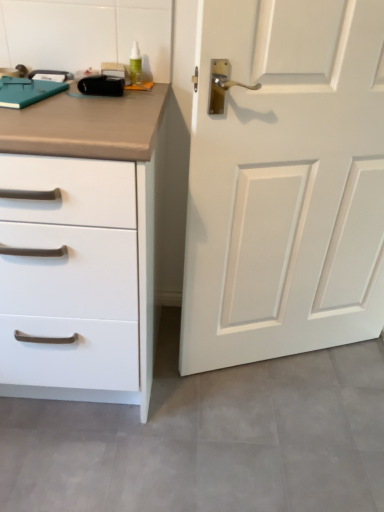
Find the location of a particular element. The height and width of the screenshot is (512, 384). white matte door at right is located at coordinates (285, 183).

What do you see at coordinates (285, 183) in the screenshot? I see `white matte door at right` at bounding box center [285, 183].

Measure the distance between white matte chest of drawers at left and camera.

The distance of white matte chest of drawers at left from camera is 33.12 inches.

The width and height of the screenshot is (384, 512). Describe the element at coordinates (81, 248) in the screenshot. I see `white matte chest of drawers at left` at that location.

Find the location of a particular element. The image size is (384, 512). white matte chest of drawers at left is located at coordinates (81, 248).

The image size is (384, 512). I want to click on white matte door at right, so click(x=285, y=183).

Considering the relative positions of white matte chest of drawers at left and white matte door at right in the image provided, is white matte chest of drawers at left to the left or to the right of white matte door at right?

Based on their positions, white matte chest of drawers at left is located to the left of white matte door at right.

Which object is closer to the camera, white matte chest of drawers at left or white matte door at right?

white matte chest of drawers at left is closer to the camera.

Which point is more forward, (x=11, y=173) or (x=361, y=100)?

The point (x=11, y=173) is closer.

From the image's perspective, which one is positioned higher, white matte chest of drawers at left or white matte door at right?

From the image's view, white matte door at right is above.

From a real-world perspective, which object stands above the other?

white matte door at right, from a real-world perspective.

Can you confirm if white matte chest of drawers at left is thinner than white matte door at right?

No.

Between white matte chest of drawers at left and white matte door at right, which one has less height?

white matte chest of drawers at left.

Does white matte chest of drawers at left have a larger size compared to white matte door at right?

Yes, white matte chest of drawers at left is bigger than white matte door at right.

Choose the correct answer: Is white matte chest of drawers at left inside white matte door at right or outside it?

white matte chest of drawers at left is located beyond the bounds of white matte door at right.

Would you say white matte chest of drawers at left is a long distance from white matte door at right?

white matte chest of drawers at left is actually quite close to white matte door at right.

Does white matte chest of drawers at left turn towards white matte door at right?

No, white matte chest of drawers at left is not turned towards white matte door at right.

Can you tell me how much white matte chest of drawers at left and white matte door at right differ in facing direction?

18.7 degrees.

Identify the location of chest of drawers that is on the left side of white matte door at right. (81, 248).

Does white matte door at right appear on the right side of white matte chest of drawers at left?

Indeed, white matte door at right is positioned on the right side of white matte chest of drawers at left.

Which is in front, white matte door at right or white matte chest of drawers at left?

white matte chest of drawers at left.

Considering the points (248, 304) and (23, 169), which point is behind, point (248, 304) or point (23, 169)?

The point (248, 304) is more distant.

From the image's perspective, is white matte door at right positioned above or below white matte chest of drawers at left?

Based on their image positions, white matte door at right is located above white matte chest of drawers at left.

From a real-world perspective, is white matte door at right located beneath white matte chest of drawers at left?

No.

Looking at this image, which object is wider, white matte door at right or white matte chest of drawers at left?

Wider between the two is white matte chest of drawers at left.

Does white matte door at right have a lesser height compared to white matte chest of drawers at left?

No, white matte door at right is not shorter than white matte chest of drawers at left.

Considering the sizes of objects white matte door at right and white matte chest of drawers at left in the image provided, who is smaller, white matte door at right or white matte chest of drawers at left?

white matte door at right is smaller.

Consider the image. Would you say white matte door at right is inside or outside white matte chest of drawers at left?

white matte door at right is spatially situated outside white matte chest of drawers at left.

Is white matte door at right with white matte chest of drawers at left?

No, white matte door at right is not in contact with white matte chest of drawers at left.

Is white matte door at right looking in the opposite direction of white matte chest of drawers at left?

white matte door at right does not have its back to white matte chest of drawers at left.

What are the coordinates of `door above the white matte chest of drawers at left (from a real-world perspective)` in the screenshot? It's located at (285, 183).

I want to click on the chest of drawers lying below the white matte door at right (from the image's perspective), so click(81, 248).

The height and width of the screenshot is (512, 384). In order to click on door positioned vertically above the white matte chest of drawers at left (from a real-world perspective) in this screenshot , I will do (285, 183).